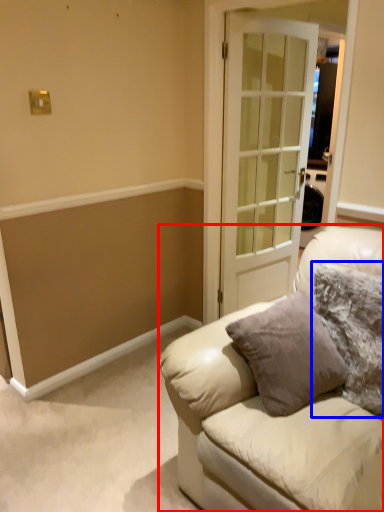
Question: Which object is closer to the camera taking this photo, studio couch (highlighted by a red box) or pillow (highlighted by a blue box)?

Choices:
 (A) studio couch
 (B) pillow

Answer: (A)